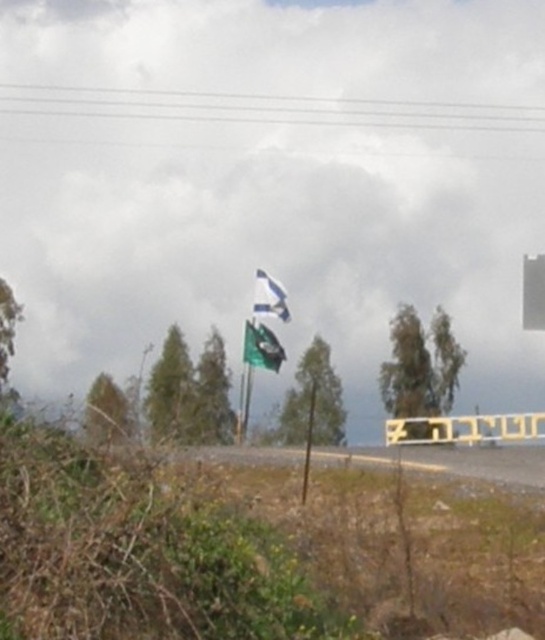
Question: Can you confirm if yellow plastic sign at center is wider than white fabric flag at upper center?

Choices:
 (A) no
 (B) yes

Answer: (A)

Question: Estimate the real-world distances between objects in this image. Which object is closer to the yellow plastic sign at center?

Choices:
 (A) white fabric flag at upper center
 (B) green fabric flag at center

Answer: (B)

Question: Does green fabric flag at center appear on the right side of white fabric flag at upper center?

Choices:
 (A) no
 (B) yes

Answer: (B)

Question: Which point is closer to the camera taking this photo?

Choices:
 (A) (269, 289)
 (B) (255, 339)

Answer: (B)

Question: Which point appears farthest from the camera in this image?

Choices:
 (A) (477, 420)
 (B) (262, 349)
 (C) (257, 305)

Answer: (C)

Question: Is yellow plastic sign at center closer to camera compared to white fabric flag at upper center?

Choices:
 (A) yes
 (B) no

Answer: (A)